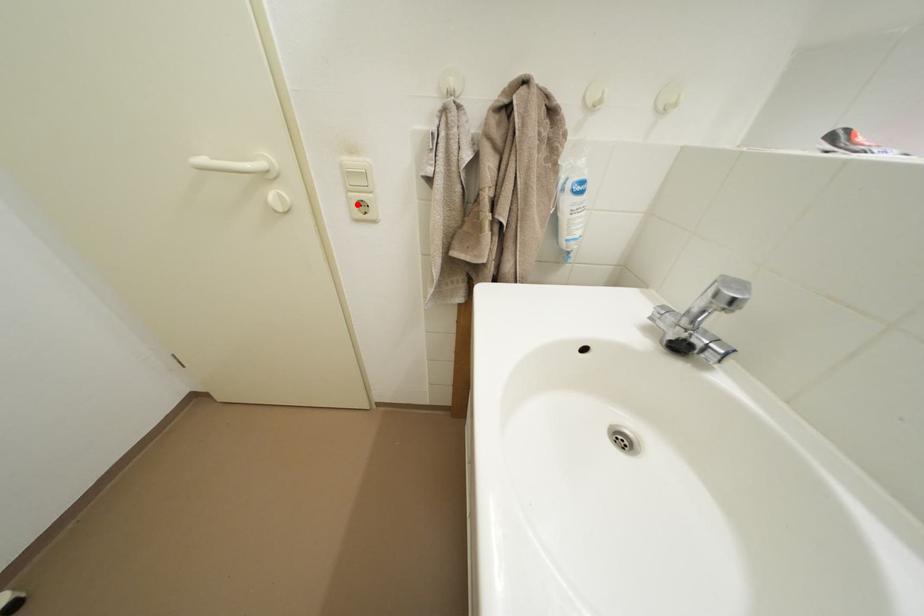
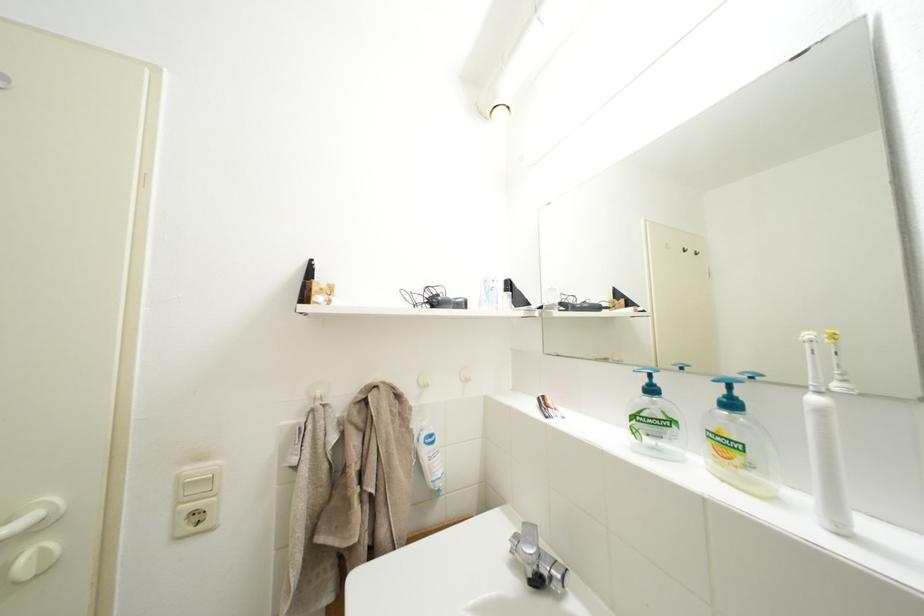
In the second image, find the point that corresponds to the highlighted location in the first image.

(185, 519)